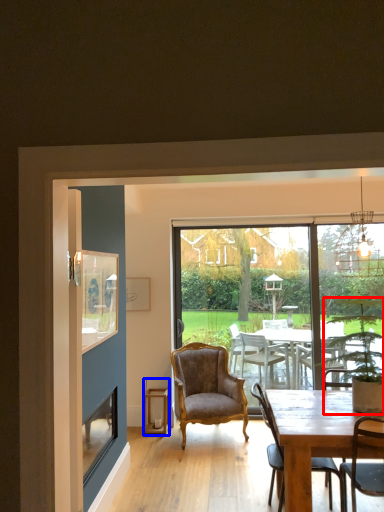
Question: Which object is closer to the camera taking this photo, houseplant (highlighted by a red box) or lantern (highlighted by a blue box)?

Choices:
 (A) houseplant
 (B) lantern

Answer: (A)